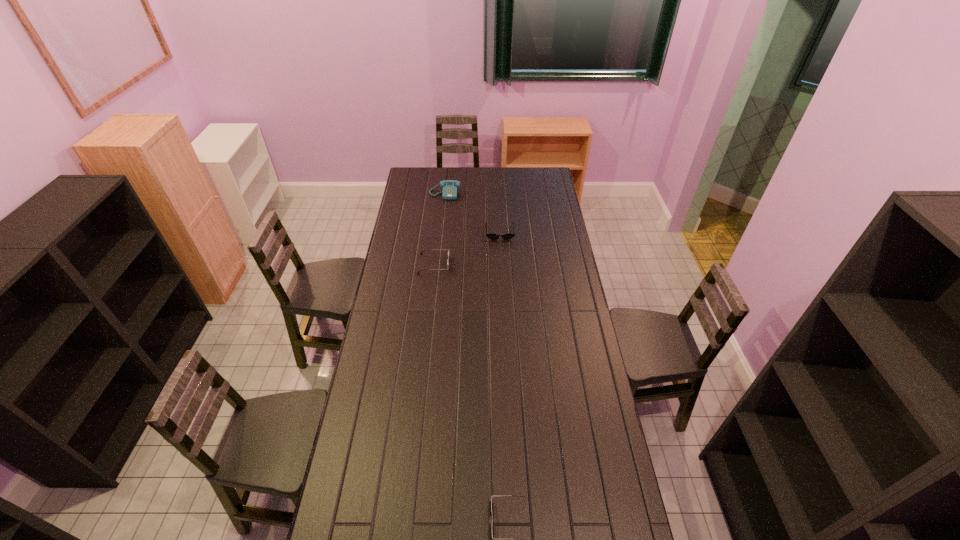
Image resolution: width=960 pixels, height=540 pixels. I want to click on the farthest object, so click(449, 192).

Locate an element on the screen. The height and width of the screenshot is (540, 960). the tallest object is located at coordinates (449, 192).

The height and width of the screenshot is (540, 960). What are the coordinates of `the tallest sunglasses` in the screenshot? It's located at (425, 249).

At what (x,y) coordinates should I click in order to perform the action: click on the leftmost sunglasses. Please return your answer as a coordinate pair (x, y). This screenshot has height=540, width=960. Looking at the image, I should click on (425, 249).

Locate an element on the screen. Image resolution: width=960 pixels, height=540 pixels. the farthest sunglasses is located at coordinates (491, 236).

At what (x,y) coordinates should I click in order to perform the action: click on the second shortest object. Please return your answer as a coordinate pair (x, y). This screenshot has height=540, width=960. Looking at the image, I should click on (491, 236).

Find the location of `vacant space situated 0.380m on the dial of the farthest object`. vacant space situated 0.380m on the dial of the farthest object is located at coordinates (440, 240).

Image resolution: width=960 pixels, height=540 pixels. Identify the location of vacant space located on the front-facing side of the second farthest sunglasses. (483, 264).

Identify the location of free location located 0.260m on the front-facing side of the farthest sunglasses. (502, 273).

Find the location of `telephone at the left edge`. telephone at the left edge is located at coordinates click(x=449, y=192).